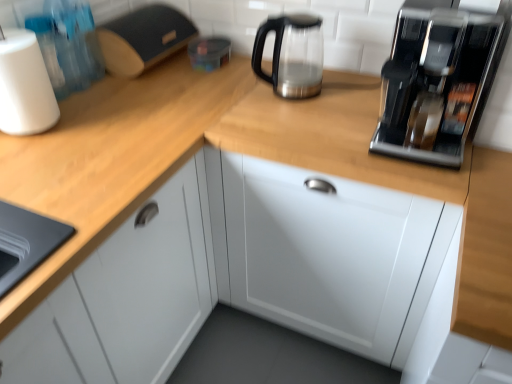
At what (x,y) coordinates should I click in order to perform the action: click on vacant space in front of white matte paper towel at left. Please return your answer as a coordinate pair (x, y). The image size is (512, 384). Looking at the image, I should click on (27, 155).